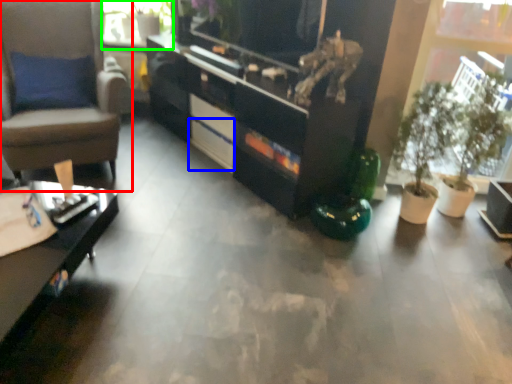
Question: Considering the real-world distances, which object is farthest from chair (highlighted by a red box)? drawer (highlighted by a blue box) or window screen (highlighted by a green box)?

Choices:
 (A) drawer
 (B) window screen

Answer: (B)